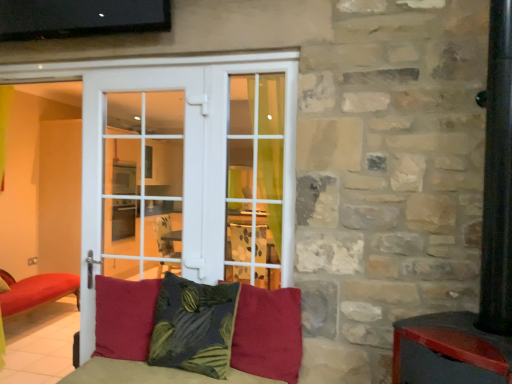
Question: Does white glass door at center turn towards dark green textured pillow at center, the 2th pillow from the right?

Choices:
 (A) yes
 (B) no

Answer: (B)

Question: Does white glass door at center have a greater width compared to dark green textured pillow at center, which is the second pillow in left-to-right order?

Choices:
 (A) yes
 (B) no

Answer: (B)

Question: Would you say white glass door at center is outside dark green textured pillow at center, the 2th pillow from the right?

Choices:
 (A) no
 (B) yes

Answer: (B)

Question: Is white glass door at center positioned with its back to dark green textured pillow at center, the 2th pillow from the right?

Choices:
 (A) no
 (B) yes

Answer: (A)

Question: Considering the relative sizes of white glass door at center and dark green textured pillow at center, the 2th pillow from the right, in the image provided, is white glass door at center taller than dark green textured pillow at center, the 2th pillow from the right,?

Choices:
 (A) no
 (B) yes

Answer: (B)

Question: From a real-world perspective, is dark green textured pillow at center, which is the second pillow in left-to-right order, above or below velvet red cushion at center, acting as the 3th pillow starting from the right?

Choices:
 (A) above
 (B) below

Answer: (A)

Question: From the image's perspective, is dark green textured pillow at center, the 2th pillow from the right, positioned above or below velvet red cushion at center, acting as the 3th pillow starting from the right?

Choices:
 (A) above
 (B) below

Answer: (A)

Question: Considering the positions of dark green textured pillow at center, the 2th pillow from the right, and velvet red cushion at center, acting as the 3th pillow starting from the right, in the image, is dark green textured pillow at center, the 2th pillow from the right, wider or thinner than velvet red cushion at center, acting as the 3th pillow starting from the right,?

Choices:
 (A) thin
 (B) wide

Answer: (B)

Question: Visually, is dark green textured pillow at center, which is the second pillow in left-to-right order, positioned to the left or to the right of velvet red cushion at center, which is counted as the 1th pillow, starting from the left?

Choices:
 (A) right
 (B) left

Answer: (A)

Question: Based on their sizes in the image, would you say velvet red pillow at center, the 1th pillow when ordered from right to left, is bigger or smaller than velvet red cushion at center, acting as the 3th pillow starting from the right?

Choices:
 (A) big
 (B) small

Answer: (B)

Question: Is point (294, 322) closer or farther from the camera than point (129, 301)?

Choices:
 (A) closer
 (B) farther

Answer: (A)

Question: Is velvet red pillow at center, the 1th pillow when ordered from right to left, to the left or to the right of velvet red cushion at center, acting as the 3th pillow starting from the right, in the image?

Choices:
 (A) right
 (B) left

Answer: (A)

Question: From the image's perspective, relative to velvet red cushion at center, acting as the 3th pillow starting from the right, is velvet red pillow at center, the 1th pillow when ordered from right to left, above or below?

Choices:
 (A) above
 (B) below

Answer: (A)

Question: Is point (152, 304) closer or farther from the camera than point (170, 340)?

Choices:
 (A) farther
 (B) closer

Answer: (A)

Question: From the image's perspective, is velvet red cushion at center, which is counted as the 1th pillow, starting from the left, positioned above or below dark green textured pillow at center, which is the second pillow in left-to-right order?

Choices:
 (A) below
 (B) above

Answer: (A)